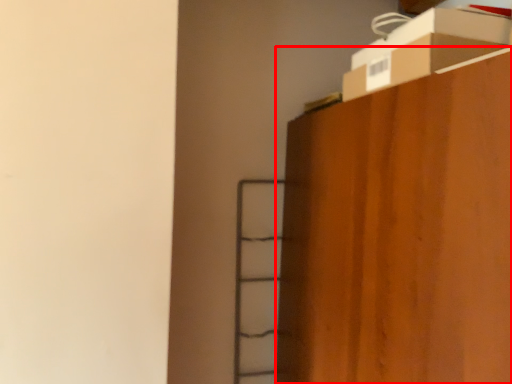
Question: From the image's perspective, what is the correct spatial positioning of furniture (annotated by the red box) in reference to cardboard box?

Choices:
 (A) below
 (B) above

Answer: (A)